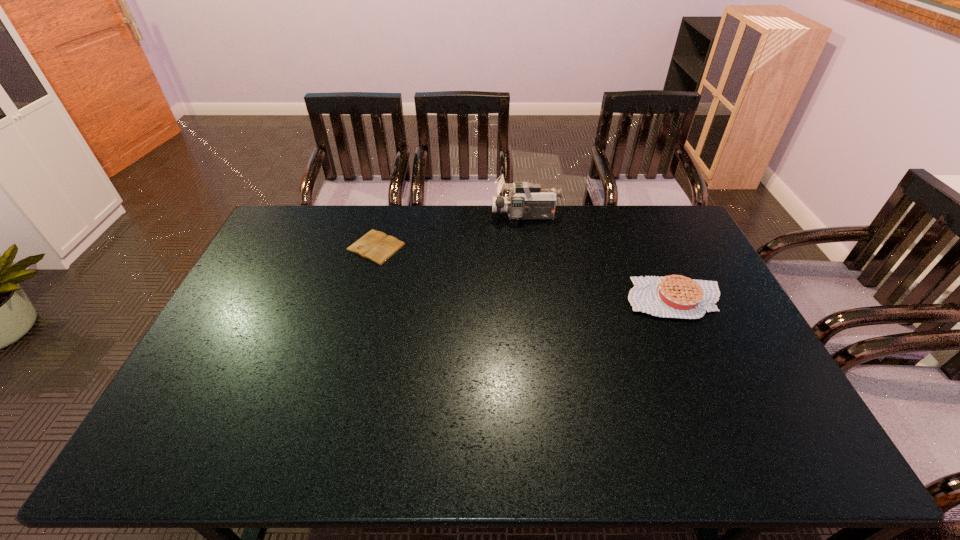
Find the location of a particular element. The height and width of the screenshot is (540, 960). vacant space situated on the front of the shortest object is located at coordinates click(x=356, y=319).

Where is `camcorder at the far edge`? This screenshot has height=540, width=960. camcorder at the far edge is located at coordinates point(527,201).

At what (x,y) coordinates should I click in order to perform the action: click on book present at the far edge. Please return your answer as a coordinate pair (x, y). Image resolution: width=960 pixels, height=540 pixels. Looking at the image, I should click on (376, 246).

The image size is (960, 540). Identify the location of object positioned at the right edge. (675, 296).

What are the coordinates of `vacant space at the far edge of the desktop` in the screenshot? It's located at (559, 205).

Find the location of a particular element. This screenshot has height=540, width=960. vacant space at the near edge of the desktop is located at coordinates (519, 458).

Where is `free spot at the left edge of the desktop`? free spot at the left edge of the desktop is located at coordinates (257, 272).

In the image, there is a desktop. What are the coordinates of `vacant space at the right edge` in the screenshot? It's located at (698, 329).

What are the coordinates of `free space at the far left corner of the desktop` in the screenshot? It's located at pyautogui.click(x=291, y=233).

In order to click on vacant space at the near left corner in this screenshot , I will do `click(214, 438)`.